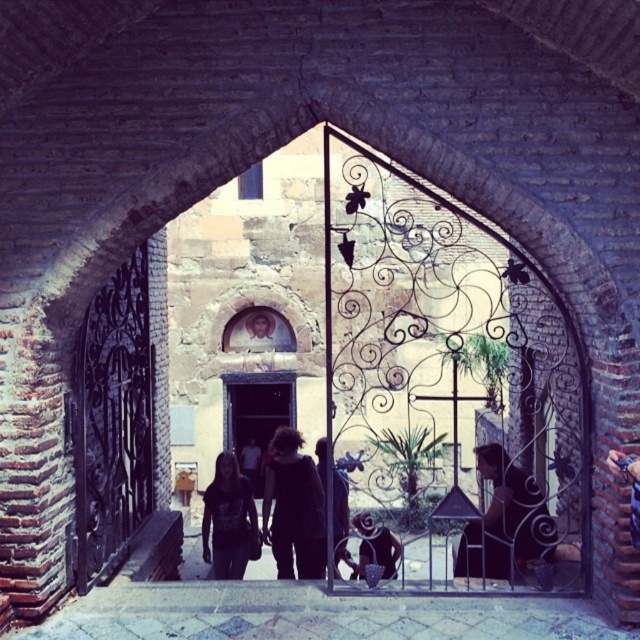
Question: Among these points, which one is farthest from the camera?

Choices:
 (A) (289, 552)
 (B) (513, 515)
 (C) (384, 570)

Answer: (A)

Question: In this image, where is dark hair at center located relative to dark blue fabric at center?

Choices:
 (A) right
 (B) left

Answer: (A)

Question: Does dark gray fabric at center have a greater width compared to dark blue fabric at center?

Choices:
 (A) yes
 (B) no

Answer: (B)

Question: Is dark fabric dress at center thinner than dark gray fabric at center?

Choices:
 (A) no
 (B) yes

Answer: (A)

Question: Among these objects, which one is farthest from the camera?

Choices:
 (A) dark blue fabric at center
 (B) dark fabric dress at center
 (C) dark wrought iron gate at left

Answer: (B)

Question: Considering the real-world distances, which object is closest to the dark gray fabric at center?

Choices:
 (A) dark fabric dress at center
 (B) dark blue fabric at center
 (C) dark hair at center

Answer: (A)